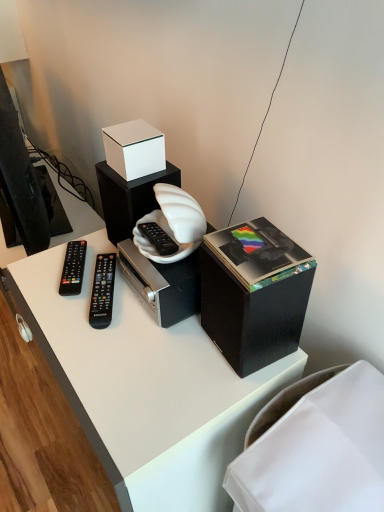
Question: Does black plastic remote at center, placed as the 2th remote control when sorted from left to right, come in front of white fabric at lower right?

Choices:
 (A) yes
 (B) no

Answer: (B)

Question: Is black plastic remote at center, the first remote control from the right, smaller than white fabric at lower right?

Choices:
 (A) no
 (B) yes

Answer: (B)

Question: Can you confirm if black plastic remote at center, placed as the 2th remote control when sorted from left to right, is positioned to the right of white fabric at lower right?

Choices:
 (A) yes
 (B) no

Answer: (B)

Question: Could you tell me if black plastic remote at center, the first remote control from the right, is facing white fabric at lower right?

Choices:
 (A) yes
 (B) no

Answer: (B)

Question: Is black plastic remote at center, placed as the 2th remote control when sorted from left to right, further to camera compared to white fabric at lower right?

Choices:
 (A) yes
 (B) no

Answer: (A)

Question: Considering the relative sizes of black plastic remote at center, the first remote control from the right, and white fabric at lower right in the image provided, is black plastic remote at center, the first remote control from the right, wider than white fabric at lower right?

Choices:
 (A) yes
 (B) no

Answer: (B)

Question: Is the depth of black plastic remote at left, marked as the 2th remote control in a right-to-left arrangement, less than that of white matte box at upper center?

Choices:
 (A) yes
 (B) no

Answer: (B)

Question: From a real-world perspective, does black plastic remote at left, marked as the 2th remote control in a right-to-left arrangement, sit lower than white matte box at upper center?

Choices:
 (A) yes
 (B) no

Answer: (A)

Question: Is black plastic remote at left, marked as the 2th remote control in a right-to-left arrangement, bigger than white matte box at upper center?

Choices:
 (A) no
 (B) yes

Answer: (A)

Question: From a real-world perspective, is black plastic remote at left, marked as the 2th remote control in a right-to-left arrangement, on top of white matte box at upper center?

Choices:
 (A) yes
 (B) no

Answer: (B)

Question: Considering the relative sizes of black plastic remote at left, marked as the 2th remote control in a right-to-left arrangement, and white matte box at upper center in the image provided, is black plastic remote at left, marked as the 2th remote control in a right-to-left arrangement, smaller than white matte box at upper center?

Choices:
 (A) no
 (B) yes

Answer: (B)

Question: Is black plastic remote at left, the first remote control viewed from the left, not close to white matte box at upper center?

Choices:
 (A) no
 (B) yes

Answer: (A)

Question: From a real-world perspective, is black plastic remote at center, placed as the 2th remote control when sorted from left to right, under black plastic remote at left, the first remote control viewed from the left?

Choices:
 (A) no
 (B) yes

Answer: (A)